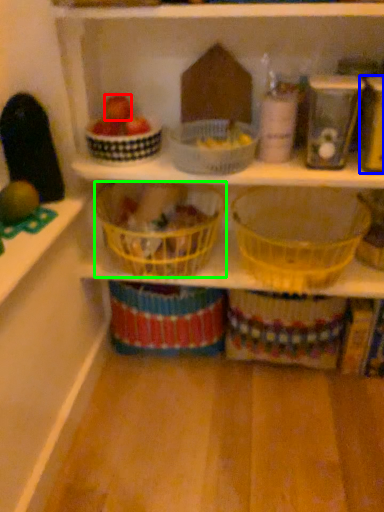
Question: Which object is positioned closest to apple (highlighted by a red box)? Select from appliance (highlighted by a blue box) and basket (highlighted by a green box).

Choices:
 (A) appliance
 (B) basket

Answer: (B)